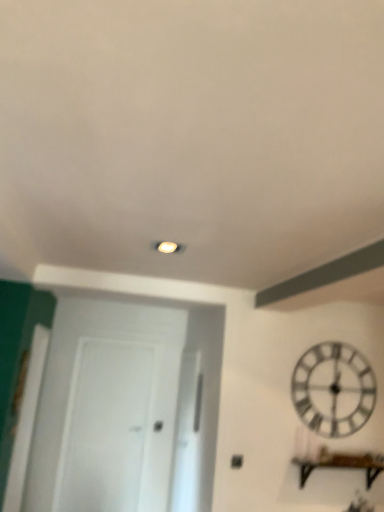
Where is `white wooden clock at upper right`? white wooden clock at upper right is located at coordinates (333, 389).

This screenshot has width=384, height=512. Identify the location of transparent glass door at center, which is the 1th glass door in right-to-left order. [187, 437].

You are a GUI agent. You are given a task and a screenshot of the screen. Output one action in this format:
    pyautogui.click(x=<x>, y=<y>)
    Task: Click on the white wooden clock at upper right
    The width and height of the screenshot is (384, 512).
    Given the screenshot: What is the action you would take?
    pyautogui.click(x=333, y=389)

Would you say brown wooden shelf at lower right contains white wooden clock at upper right?

No, white wooden clock at upper right is located outside of brown wooden shelf at lower right.

Is brown wooden shelf at lower right bigger or smaller than white wooden clock at upper right?

Considering their sizes, brown wooden shelf at lower right takes up more space than white wooden clock at upper right.

Can you confirm if brown wooden shelf at lower right is shorter than white wooden clock at upper right?

Correct, brown wooden shelf at lower right is not as tall as white wooden clock at upper right.

Which object is positioned more to the right, brown wooden shelf at lower right or white wooden clock at upper right?

From the viewer's perspective, brown wooden shelf at lower right appears more on the right side.

Between point (310, 465) and point (176, 475), which one is positioned behind?

The point (176, 475) is farther.

Is brown wooden shelf at lower right next to transparent glass door at center, the 2th glass door positioned from the left, and touching it?

No.

Is brown wooden shelf at lower right turned away from transparent glass door at center, the 2th glass door positioned from the left?

Absolutely, brown wooden shelf at lower right is directed away from transparent glass door at center, the 2th glass door positioned from the left.

Is brown wooden shelf at lower right at the left side of transparent glass door at center, which is the 1th glass door in right-to-left order?

Incorrect, brown wooden shelf at lower right is not on the left side of transparent glass door at center, which is the 1th glass door in right-to-left order.

Which of these two, transparent glass door at center, which is the 1th glass door in right-to-left order, or brown wooden shelf at lower right, stands shorter?

brown wooden shelf at lower right is shorter.

From the image's perspective, is transparent glass door at center, which is the 1th glass door in right-to-left order, on brown wooden shelf at lower right?

No, from the image's perspective, transparent glass door at center, which is the 1th glass door in right-to-left order, is not over brown wooden shelf at lower right.

Considering the positions of objects transparent glass door at center, which is the 1th glass door in right-to-left order, and brown wooden shelf at lower right in the image provided, who is in front, transparent glass door at center, which is the 1th glass door in right-to-left order, or brown wooden shelf at lower right?

brown wooden shelf at lower right is in front.

Is white wooden clock at upper right to the right of transparent glass door at center, the 2th glass door positioned from the left, from the viewer's perspective?

Yes.

From the image's perspective, is white wooden clock at upper right positioned above or below transparent glass door at center, the 2th glass door positioned from the left?

white wooden clock at upper right is above transparent glass door at center, the 2th glass door positioned from the left.

Identify the location of wall clock above the transparent glass door at center, the 2th glass door positioned from the left (from a real-world perspective). (333, 389).

Is point (110, 422) closer or farther from the camera than point (200, 413)?

Point (110, 422) is positioned farther from the camera compared to point (200, 413).

Is transparent glass door at center, arranged as the 2th glass door when viewed from the right, looking in the opposite direction of transparent glass door at center, which is the 1th glass door in right-to-left order?

That's not correct — transparent glass door at center, arranged as the 2th glass door when viewed from the right, is not looking away from transparent glass door at center, which is the 1th glass door in right-to-left order.

From a real-world perspective, relative to transparent glass door at center, the 2th glass door positioned from the left, is transparent glass door at center, arranged as the 2th glass door when viewed from the right, vertically above or below?

transparent glass door at center, arranged as the 2th glass door when viewed from the right, is below transparent glass door at center, the 2th glass door positioned from the left.

Is transparent glass door at center, arranged as the 2th glass door when viewed from the right, in front of or behind transparent glass door at center, which is the 1th glass door in right-to-left order, in the image?

transparent glass door at center, arranged as the 2th glass door when viewed from the right, is behind transparent glass door at center, which is the 1th glass door in right-to-left order.

Considering the relative positions of transparent glass door at center, arranged as the 2th glass door when viewed from the right, and white wooden clock at upper right in the image provided, is transparent glass door at center, arranged as the 2th glass door when viewed from the right, to the left or to the right of white wooden clock at upper right?

transparent glass door at center, arranged as the 2th glass door when viewed from the right, is to the left of white wooden clock at upper right.

Is transparent glass door at center, the first glass door from the left, oriented away from white wooden clock at upper right?

transparent glass door at center, the first glass door from the left, does not have its back to white wooden clock at upper right.

There is a white wooden clock at upper right. Identify the location of the 2nd glass door below it (from the image's perspective). The height and width of the screenshot is (512, 384). (113, 426).

From a real-world perspective, is transparent glass door at center, arranged as the 2th glass door when viewed from the right, below white wooden clock at upper right?

Yes.

Can you confirm if transparent glass door at center, the 2th glass door positioned from the left, is bigger than white wooden clock at upper right?

Yes, transparent glass door at center, the 2th glass door positioned from the left, is bigger than white wooden clock at upper right.

Are transparent glass door at center, the 2th glass door positioned from the left, and white wooden clock at upper right far apart?

Yes, transparent glass door at center, the 2th glass door positioned from the left, and white wooden clock at upper right are quite far apart.

Can you confirm if transparent glass door at center, which is the 1th glass door in right-to-left order, is shorter than white wooden clock at upper right?

No, transparent glass door at center, which is the 1th glass door in right-to-left order, is not shorter than white wooden clock at upper right.

This screenshot has height=512, width=384. I want to click on furniture below the white wooden clock at upper right (from the image's perspective), so click(342, 464).

Where is `glass door that is the 1st object located behind the brown wooden shelf at lower right`? Image resolution: width=384 pixels, height=512 pixels. glass door that is the 1st object located behind the brown wooden shelf at lower right is located at coordinates point(187,437).

When comparing their distances from brown wooden shelf at lower right, does transparent glass door at center, which is the 1th glass door in right-to-left order, or transparent glass door at center, arranged as the 2th glass door when viewed from the right, seem closer?

transparent glass door at center, which is the 1th glass door in right-to-left order, lies closer to brown wooden shelf at lower right than the other object.

Looking at the image, which one is located further to brown wooden shelf at lower right, transparent glass door at center, the first glass door from the left, or white wooden clock at upper right?

transparent glass door at center, the first glass door from the left, lies further to brown wooden shelf at lower right than the other object.

When comparing their distances from transparent glass door at center, arranged as the 2th glass door when viewed from the right, does brown wooden shelf at lower right or transparent glass door at center, which is the 1th glass door in right-to-left order, seem closer?

Among the two, transparent glass door at center, which is the 1th glass door in right-to-left order, is located nearer to transparent glass door at center, arranged as the 2th glass door when viewed from the right.

From the picture: Based on their spatial positions, is transparent glass door at center, the first glass door from the left, or transparent glass door at center, the 2th glass door positioned from the left, closer to white wooden clock at upper right?

transparent glass door at center, the 2th glass door positioned from the left, is positioned closer to the anchor white wooden clock at upper right.

Considering their positions, is white wooden clock at upper right positioned closer to transparent glass door at center, arranged as the 2th glass door when viewed from the right, than transparent glass door at center, the 2th glass door positioned from the left?

Among the two, transparent glass door at center, the 2th glass door positioned from the left, is located nearer to transparent glass door at center, arranged as the 2th glass door when viewed from the right.

Considering their positions, is transparent glass door at center, arranged as the 2th glass door when viewed from the right, positioned closer to transparent glass door at center, which is the 1th glass door in right-to-left order, than white wooden clock at upper right?

transparent glass door at center, arranged as the 2th glass door when viewed from the right.

Considering their positions, is white wooden clock at upper right positioned closer to brown wooden shelf at lower right than transparent glass door at center, the 2th glass door positioned from the left?

white wooden clock at upper right is closer to brown wooden shelf at lower right.

Looking at the image, which one is located further to brown wooden shelf at lower right, transparent glass door at center, the first glass door from the left, or transparent glass door at center, the 2th glass door positioned from the left?

Based on the image, transparent glass door at center, the first glass door from the left, appears to be further to brown wooden shelf at lower right.

Where is `glass door situated between transparent glass door at center, arranged as the 2th glass door when viewed from the right, and white wooden clock at upper right from left to right`? This screenshot has height=512, width=384. glass door situated between transparent glass door at center, arranged as the 2th glass door when viewed from the right, and white wooden clock at upper right from left to right is located at coordinates (187, 437).

Find the location of a particular element. This screenshot has width=384, height=512. wall clock between transparent glass door at center, which is the 1th glass door in right-to-left order, and brown wooden shelf at lower right from left to right is located at coordinates (333, 389).

This screenshot has width=384, height=512. Find the location of `wall clock situated between transparent glass door at center, arranged as the 2th glass door when viewed from the right, and brown wooden shelf at lower right from left to right`. wall clock situated between transparent glass door at center, arranged as the 2th glass door when viewed from the right, and brown wooden shelf at lower right from left to right is located at coordinates pyautogui.click(x=333, y=389).

Find the location of a particular element. The height and width of the screenshot is (512, 384). glass door between transparent glass door at center, arranged as the 2th glass door when viewed from the right, and brown wooden shelf at lower right from left to right is located at coordinates (187, 437).